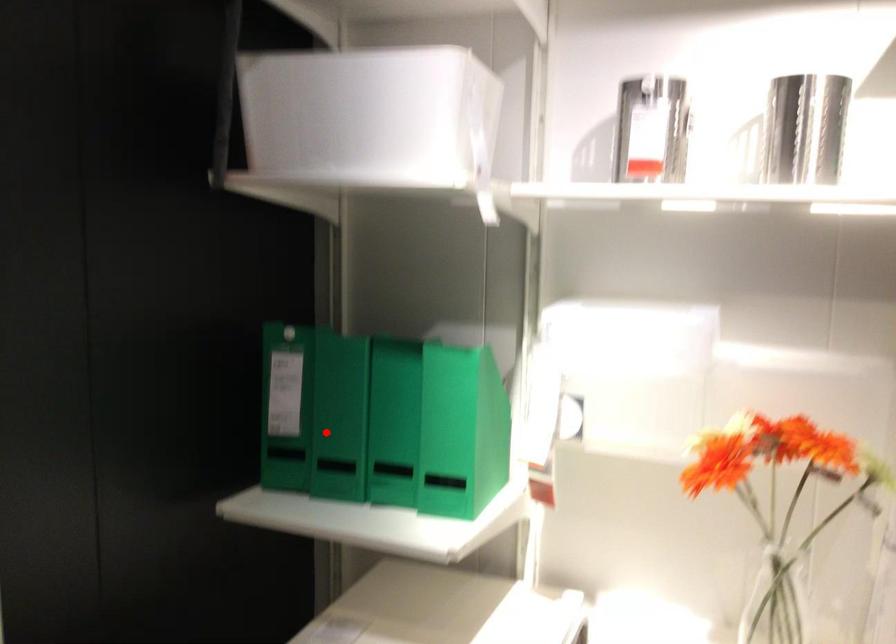
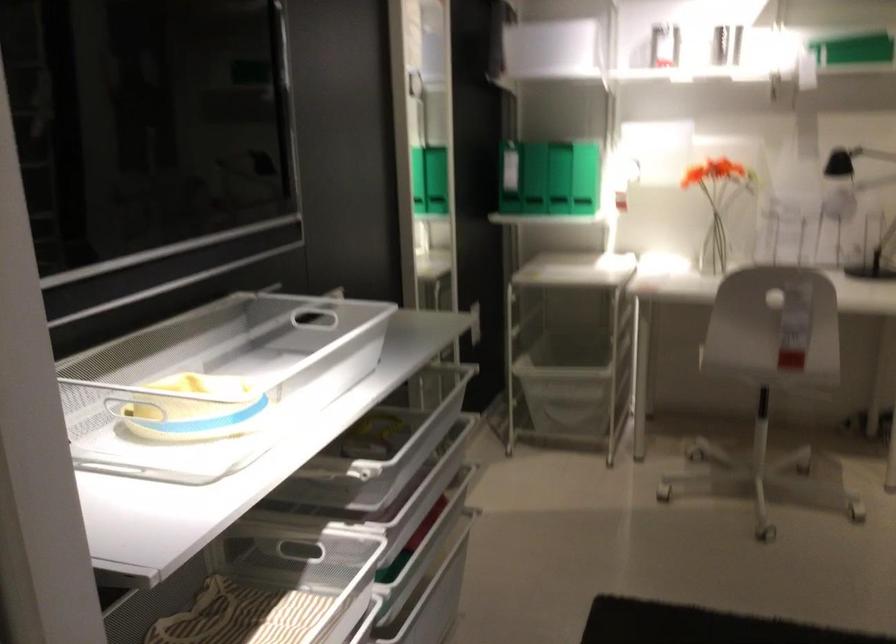
Question: I am providing you with two images of the same scene from different viewpoints. A red point is marked on the first image. At the location where the point appears in image 1, is it still visible in image 2?

Choices:
 (A) Yes
 (B) No

Answer: (A)